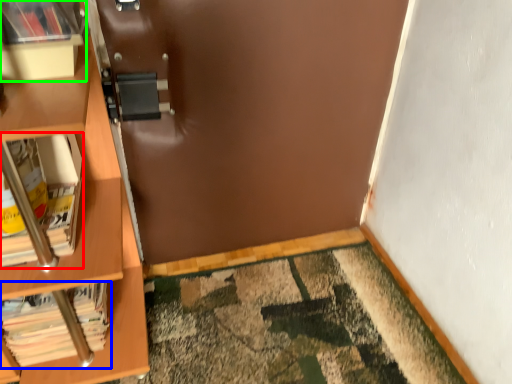
Question: Which object is positioned farthest from book (highlighted by a red box)? Select from book (highlighted by a blue box) and shelf (highlighted by a green box).

Choices:
 (A) book
 (B) shelf

Answer: (A)